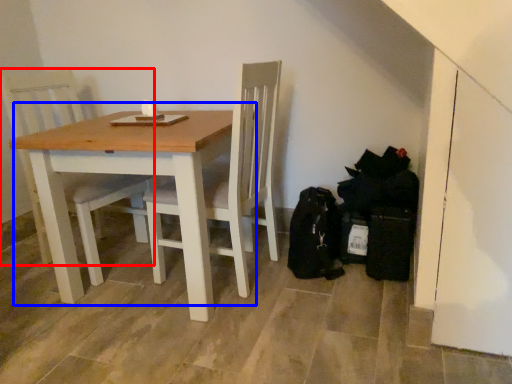
Question: Which of the following is the farthest to the observer, chair (highlighted by a red box) or table (highlighted by a blue box)?

Choices:
 (A) chair
 (B) table

Answer: (A)